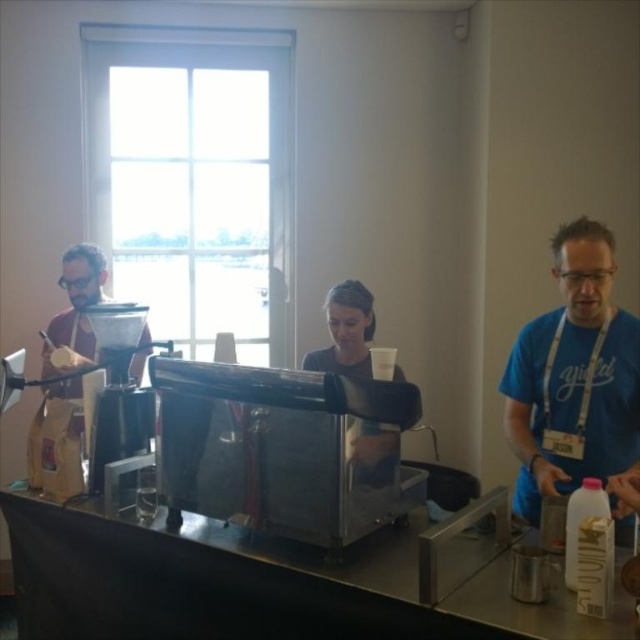
Can you confirm if metallic silver coffee machine at center is shorter than dark gray shirt at center?

In fact, metallic silver coffee machine at center may be taller than dark gray shirt at center.

Which is in front, point (132, 305) or point (330, 308)?

Point (132, 305) is more forward.

Between point (140, 317) and point (396, 456), which one is positioned in front?

Positioned in front is point (396, 456).

Identify the location of metallic silver coffee machine at center. (118, 388).

Who is positioned more to the right, blue cotton shirt at right or metallic silver coffee machine at center?

From the viewer's perspective, blue cotton shirt at right appears more on the right side.

What are the coordinates of `blue cotton shirt at right` in the screenshot? It's located at click(x=573, y=378).

Describe the element at coordinates (573, 378) in the screenshot. I see `blue cotton shirt at right` at that location.

What are the coordinates of `blue cotton shirt at right` in the screenshot? It's located at (573, 378).

Is blue cotton shirt at right below dark gray shirt at center?

Correct, blue cotton shirt at right is located below dark gray shirt at center.

Can you confirm if blue cotton shirt at right is smaller than dark gray shirt at center?

No.

Is point (550, 369) less distant than point (349, 317)?

Yes, it is.

Find the location of a particular element. This screenshot has width=640, height=640. blue cotton shirt at right is located at coordinates (573, 378).